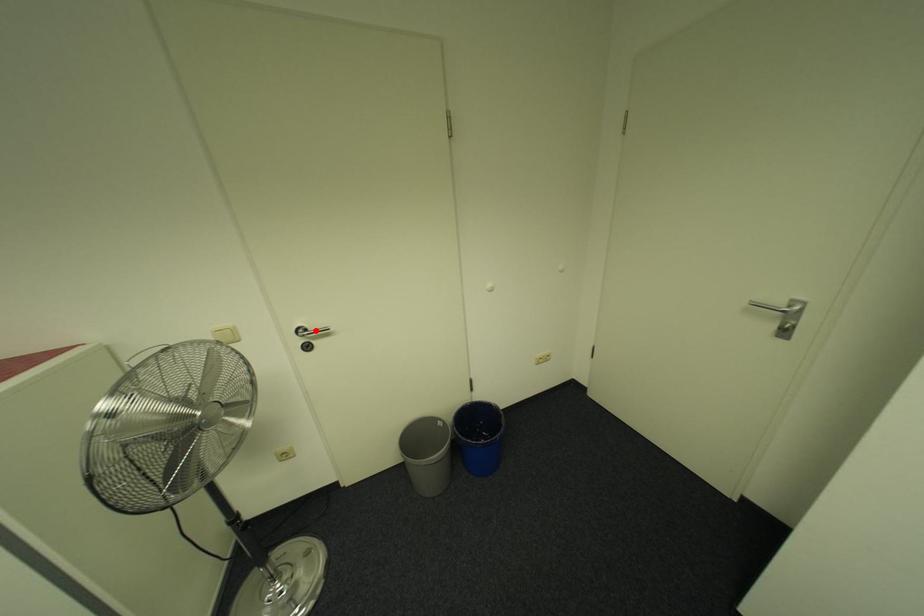
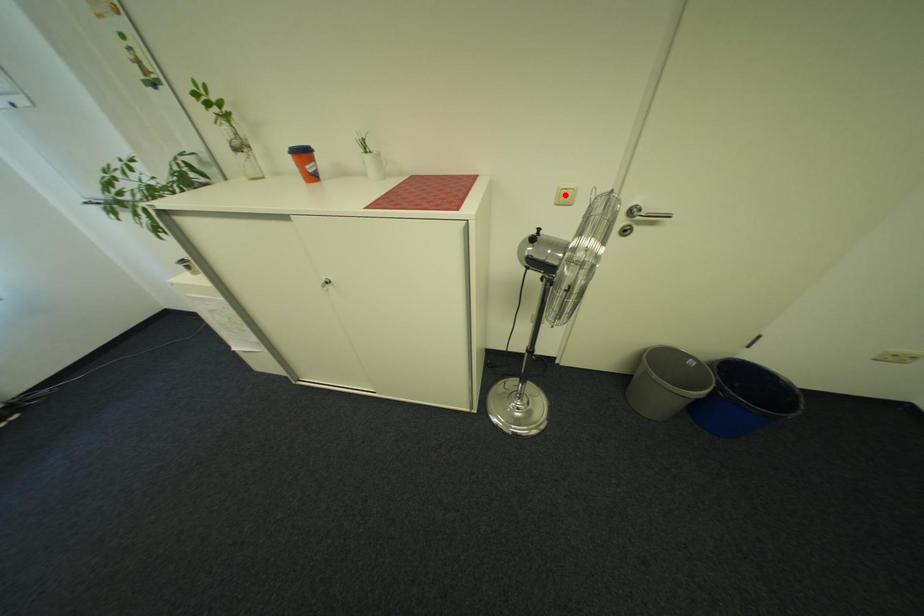
I am providing you with two images of the same scene from different viewpoints. A red point is marked on the first image and another point is marked on the second image. Are the points marked in image1 and image2 representing the same 3D position?

No